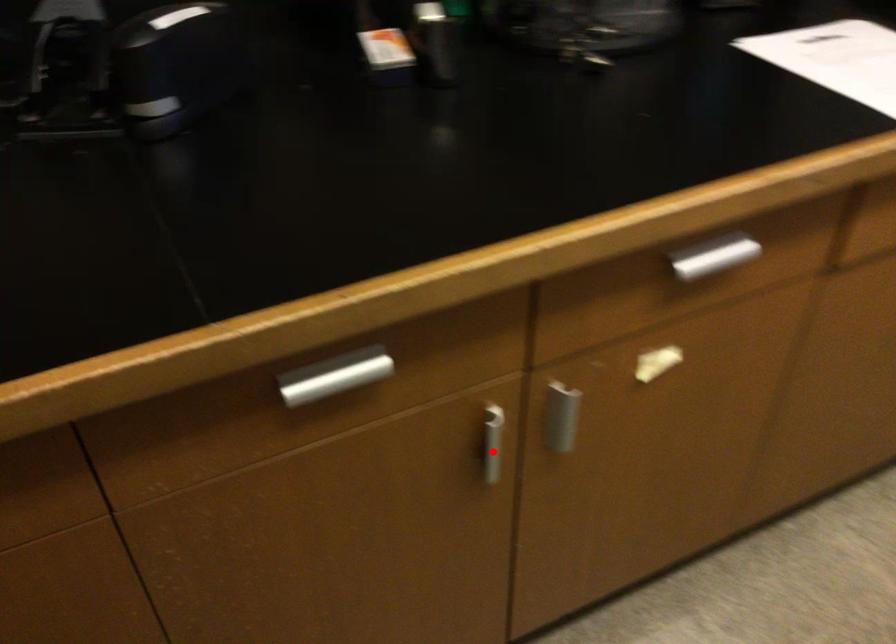
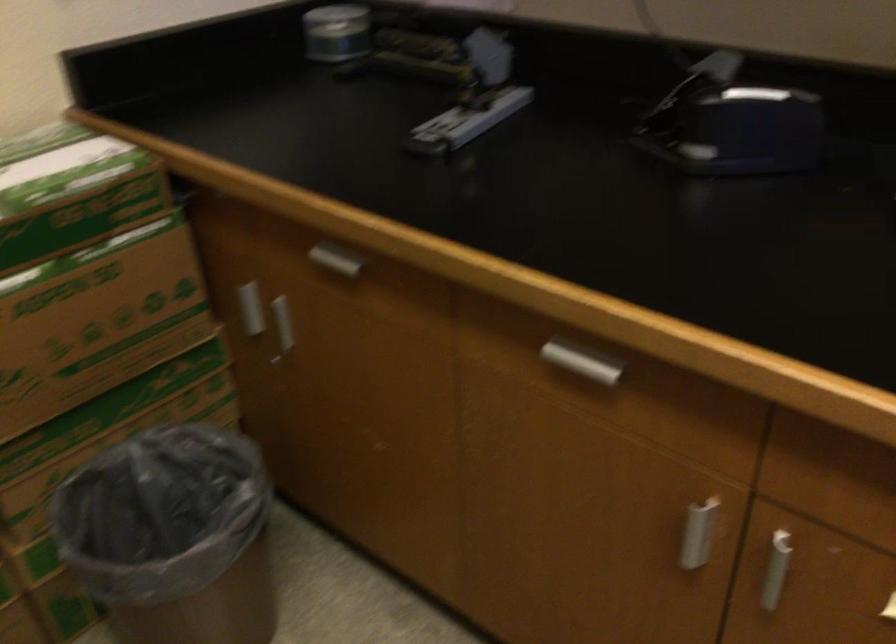
In the second image, find the point that corresponds to the highlighted location in the first image.

(695, 536)